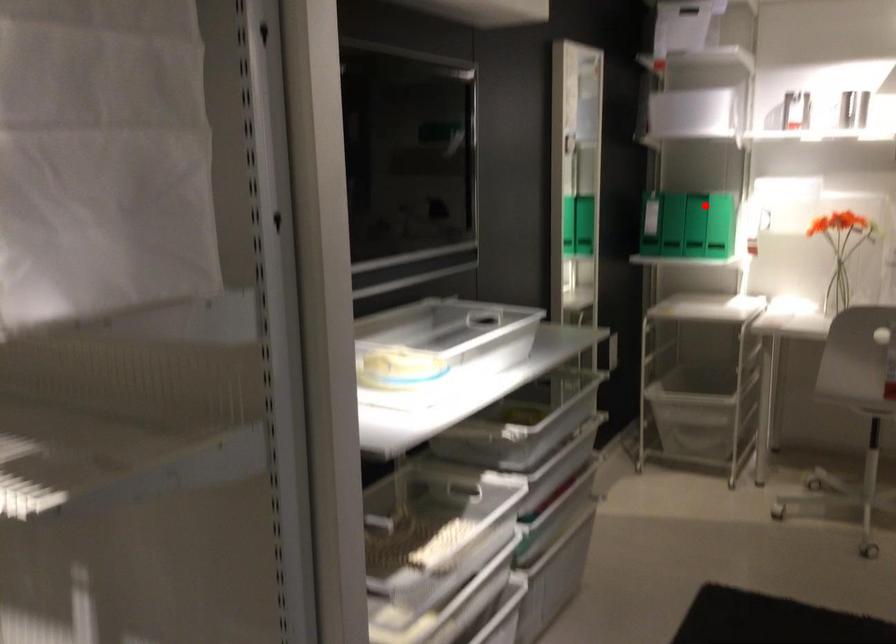
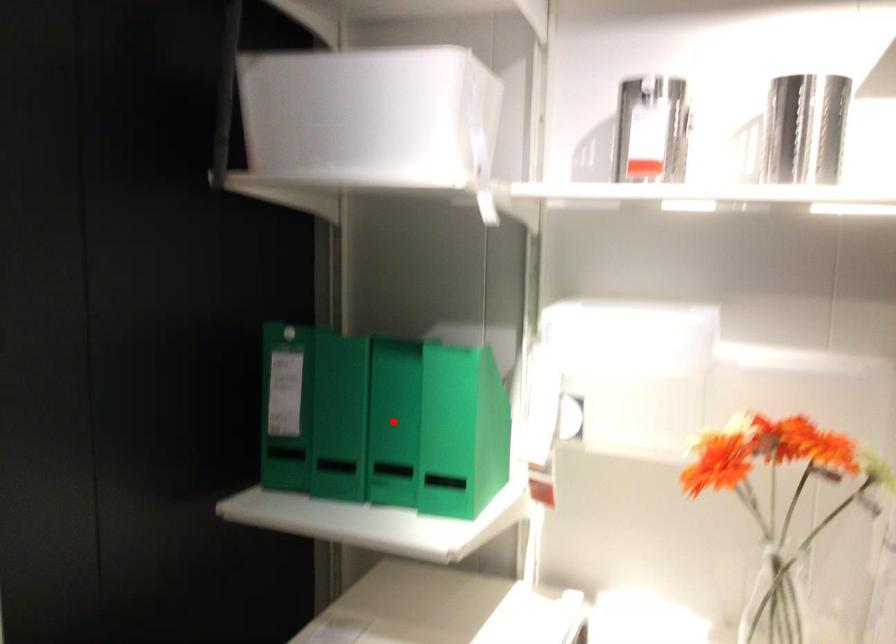
I am providing you with two images of the same scene from different viewpoints. A red point is marked on the first image and another point is marked on the second image. Are the points marked in image1 and image2 representing the same 3D position?

No